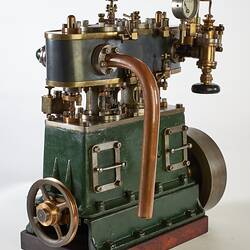
Where is `wall`? wall is located at coordinates (230, 128).